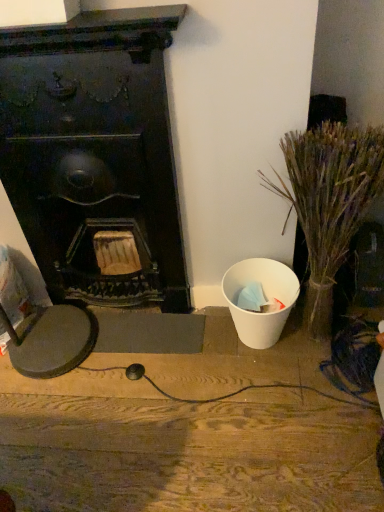
What is the approximate height of white matte trash can at right?

white matte trash can at right is 1.49 inches in height.

Find the location of a particular element. dry grass at right is located at coordinates (330, 190).

Considering the relative sizes of dry grass at right and black matte fireplace at left in the image provided, is dry grass at right thinner than black matte fireplace at left?

Incorrect, the width of dry grass at right is not less than that of black matte fireplace at left.

Considering the relative sizes of dry grass at right and black matte fireplace at left in the image provided, is dry grass at right taller than black matte fireplace at left?

In fact, dry grass at right may be shorter than black matte fireplace at left.

Is point (351, 181) closer or farther from the camera than point (170, 186)?

Point (351, 181).

Is dry grass at right smaller than black matte fireplace at left?

Indeed, dry grass at right has a smaller size compared to black matte fireplace at left.

Considering the sizes of objects black matte fireplace at left and white matte trash can at right in the image provided, who is bigger, black matte fireplace at left or white matte trash can at right?

black matte fireplace at left is bigger.

Does black matte fireplace at left have a lesser width compared to white matte trash can at right?

Yes, black matte fireplace at left is thinner than white matte trash can at right.

From the image's perspective, would you say black matte fireplace at left is shown under white matte trash can at right?

Incorrect, from the image's perspective, black matte fireplace at left is higher than white matte trash can at right.

Locate an element on the screen. fireplace in front of the dry grass at right is located at coordinates (94, 152).

Considering the sizes of objects black matte fireplace at left and dry grass at right in the image provided, who is wider, black matte fireplace at left or dry grass at right?

dry grass at right is wider.

From the image's perspective, is black matte fireplace at left beneath dry grass at right?

No, from the image's perspective, black matte fireplace at left is not below dry grass at right.

From the image's perspective, is white matte trash can at right located above or below black matte fireplace at left?

white matte trash can at right is below black matte fireplace at left.

Where is `fireplace located in front of the white matte trash can at right`? fireplace located in front of the white matte trash can at right is located at coordinates (94, 152).

Is white matte trash can at right turned away from black matte fireplace at left?

No, white matte trash can at right is not facing the opposite direction of black matte fireplace at left.

Looking at this image, which of these two, white matte trash can at right or black matte fireplace at left, is smaller?

With smaller size is white matte trash can at right.

Does point (21, 438) lie behind point (310, 210)?

Yes, point (21, 438) is farther from viewer.

From the image's perspective, would you say white matte trash can at right is positioned over dry grass at right?

No, from the image's perspective, white matte trash can at right is not above dry grass at right.

Where is `plant on the right of white matte trash can at right`? This screenshot has height=512, width=384. plant on the right of white matte trash can at right is located at coordinates (330, 190).

Based on the photo, is white matte trash can at right wider or thinner than dry grass at right?

white matte trash can at right is wider than dry grass at right.

Does point (356, 209) lie in front of point (248, 508)?

That is True.

From a real-world perspective, is dry grass at right positioned over white matte trash can at right based on gravity?

Indeed, from a real-world perspective, dry grass at right stands above white matte trash can at right.

From the image's perspective, relative to white matte trash can at right, is dry grass at right above or below?

From the image's perspective, dry grass at right appears above white matte trash can at right.

How different are the orientations of dry grass at right and white matte trash can at right in degrees?

The angle between the facing direction of dry grass at right and the facing direction of white matte trash can at right is 0.163 degrees.

Find the location of a particular element. plant behind the black matte fireplace at left is located at coordinates click(x=330, y=190).

Identify the location of fireplace above the white matte trash can at right (from a real-world perspective). (94, 152).

Estimate the real-world distances between objects in this image. Which object is further from black matte fireplace at left, dry grass at right or white matte trash can at right?

The object further to black matte fireplace at left is white matte trash can at right.

From the image, which object appears to be farther from dry grass at right, white matte trash can at right or black matte fireplace at left?

white matte trash can at right is further to dry grass at right.

Based on their spatial positions, is black matte fireplace at left or white matte trash can at right closer to dry grass at right?

Based on the image, black matte fireplace at left appears to be nearer to dry grass at right.

Looking at the image, which one is located further to white matte trash can at right, black matte fireplace at left or dry grass at right?

dry grass at right lies further to white matte trash can at right than the other object.

In the scene shown: Looking at the image, which one is located closer to white matte trash can at right, dry grass at right or black matte fireplace at left?

black matte fireplace at left.

Looking at the image, which one is located further to black matte fireplace at left, white matte trash can at right or dry grass at right?

Among the two, white matte trash can at right is located further to black matte fireplace at left.

In order to click on furniture between black matte fireplace at left and dry grass at right in this screenshot , I will do (191, 432).